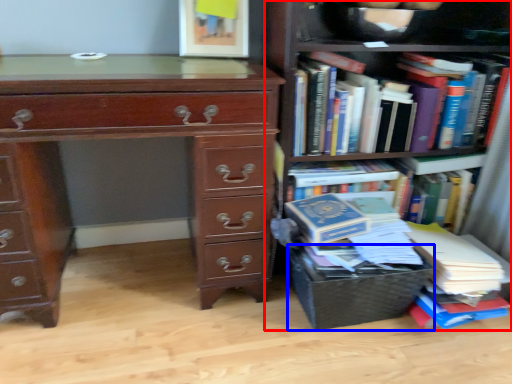
Question: Which object is closer to the camera taking this photo, bookcase (highlighted by a red box) or crate (highlighted by a blue box)?

Choices:
 (A) bookcase
 (B) crate

Answer: (A)